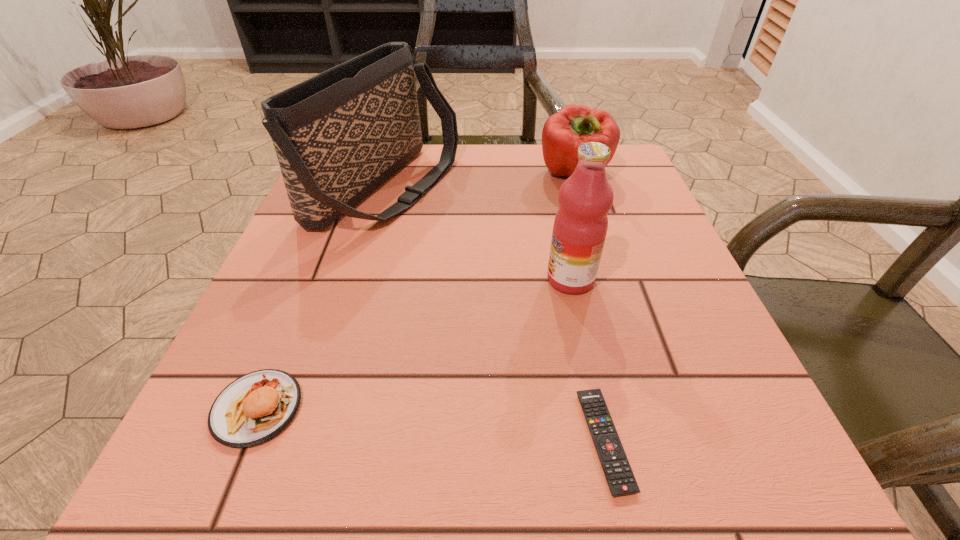
The width and height of the screenshot is (960, 540). I want to click on object present at the near left corner, so click(255, 407).

You are a GUI agent. You are given a task and a screenshot of the screen. Output one action in this format:
    pyautogui.click(x=<x>, y=<y>)
    Task: Click on the object that is at the far right corner
    The image size is (960, 540).
    Given the screenshot: What is the action you would take?
    pyautogui.click(x=563, y=132)

Where is `free space at the far edge of the desktop`? The width and height of the screenshot is (960, 540). free space at the far edge of the desktop is located at coordinates pos(501,154).

The image size is (960, 540). In the image, there is a desktop. In order to click on vacant space at the near edge in this screenshot , I will do `click(497, 451)`.

In the image, there is a desktop. Where is `free space at the left edge`? free space at the left edge is located at coordinates (350, 237).

Find the location of `vacant region at the right edge of the desktop`. vacant region at the right edge of the desktop is located at coordinates (715, 410).

The image size is (960, 540). I want to click on free point at the far left corner, so click(368, 197).

In the image, there is a desktop. Where is `free space at the near left corner`? This screenshot has height=540, width=960. free space at the near left corner is located at coordinates (291, 450).

This screenshot has width=960, height=540. In the image, there is a desktop. Identify the location of vacant area at the near right corner. (680, 476).

Where is `vacant space that is in between the bell pepper and the patty`? The width and height of the screenshot is (960, 540). vacant space that is in between the bell pepper and the patty is located at coordinates (416, 292).